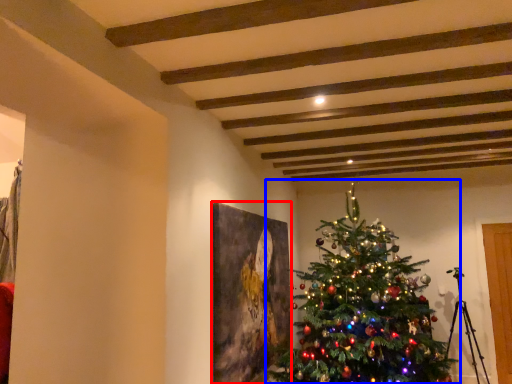
Question: Which point is further to the camera, picture frame (highlighted by a red box) or christmas tree (highlighted by a blue box)?

Choices:
 (A) picture frame
 (B) christmas tree

Answer: (A)